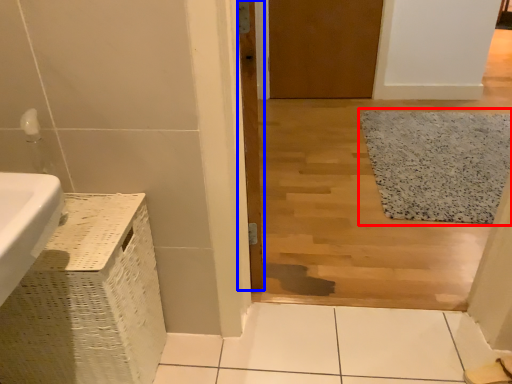
Question: Which of the following is the closest to the observer, bath mat (highlighted by a red box) or door (highlighted by a blue box)?

Choices:
 (A) bath mat
 (B) door

Answer: (B)